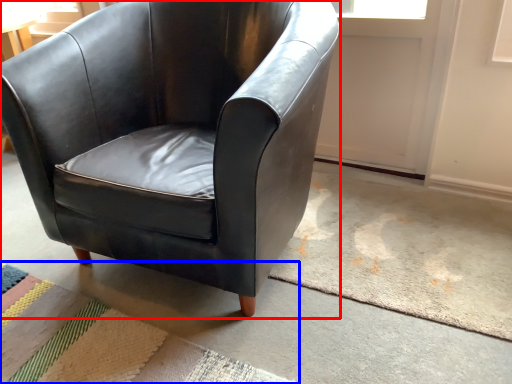
Question: Which of the following is the farthest to the observer, chair (highlighted by a red box) or mat (highlighted by a blue box)?

Choices:
 (A) chair
 (B) mat

Answer: (B)